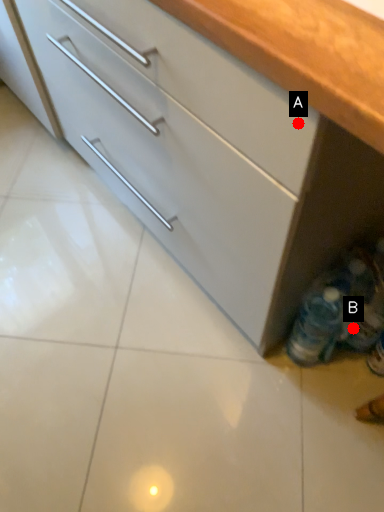
Question: Two points are circled on the image, labeled by A and B beside each circle. Which point is farther from the camera taking this photo?

Choices:
 (A) A is further
 (B) B is further

Answer: (B)